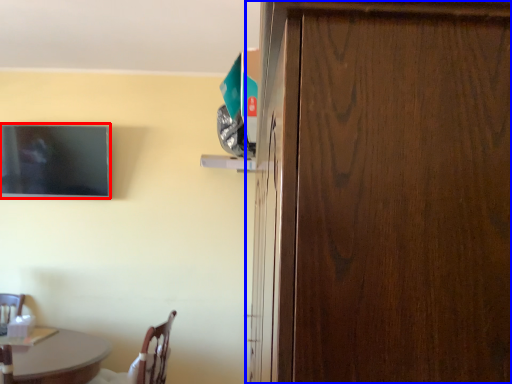
Question: Among these objects, which one is farthest to the camera, television (highlighted by a red box) or door (highlighted by a blue box)?

Choices:
 (A) television
 (B) door

Answer: (A)